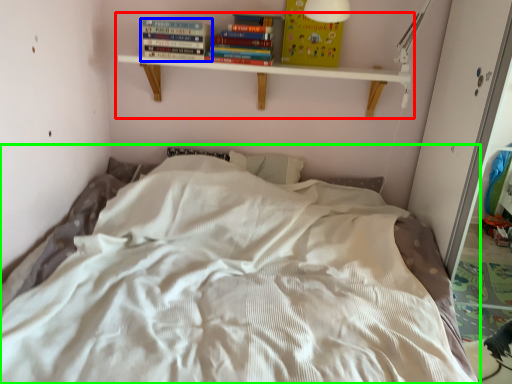
Question: Considering the real-world distances, which object is closest to shelf (highlighted by a red box)? book (highlighted by a blue box) or bed (highlighted by a green box).

Choices:
 (A) book
 (B) bed

Answer: (A)